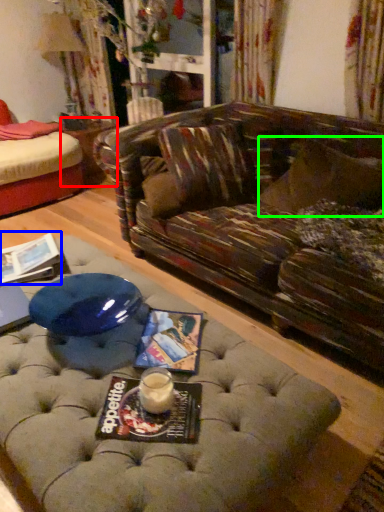
Question: Which is nearer to the side table (highlighted by a red box)? magazine (highlighted by a blue box) or pillow (highlighted by a green box).

Choices:
 (A) magazine
 (B) pillow

Answer: (A)